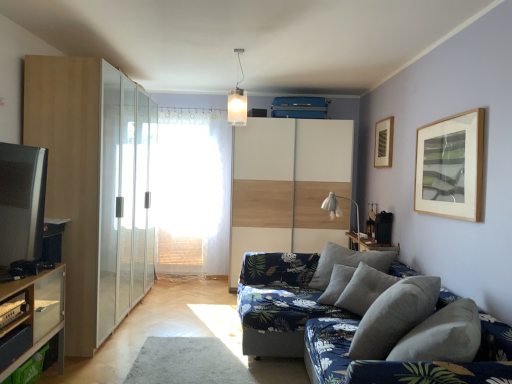
Question: Considering the positions of white wood dresser at center, which is counted as the first dresser, starting from the right, and wooden framed artwork at upper right in the image, is white wood dresser at center, which is counted as the first dresser, starting from the right, wider or thinner than wooden framed artwork at upper right?

Choices:
 (A) thin
 (B) wide

Answer: (B)

Question: Is white wood dresser at center, positioned as the 2th dresser in left-to-right order, spatially inside wooden framed artwork at upper right, or outside of it?

Choices:
 (A) inside
 (B) outside

Answer: (B)

Question: Which is farther from the white wood dresser at center, positioned as the second dresser in front-to-back order?

Choices:
 (A) gray fabric pillow at lower right
 (B) wooden framed artwork at upper right
 (C) white glass pendant light at upper center
 (D) wooden table at right
 (E) white fabric lampshade at upper center

Answer: (A)

Question: Which object is positioned farthest from the matte glass cabinet at left, positioned as the second dresser in right-to-left order?

Choices:
 (A) wooden framed artwork at upper right
 (B) transparent glass screen door at left
 (C) gray fabric pillow at lower right
 (D) white glass pendant light at upper center
 (E) wooden shelf at lower left

Answer: (A)